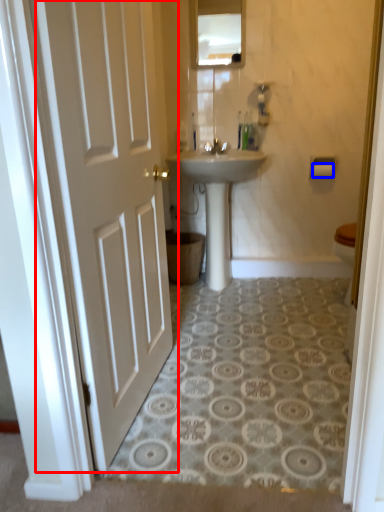
Question: Which of the following is the closest to the observer, door (highlighted by a red box) or toilet paper (highlighted by a blue box)?

Choices:
 (A) door
 (B) toilet paper

Answer: (A)